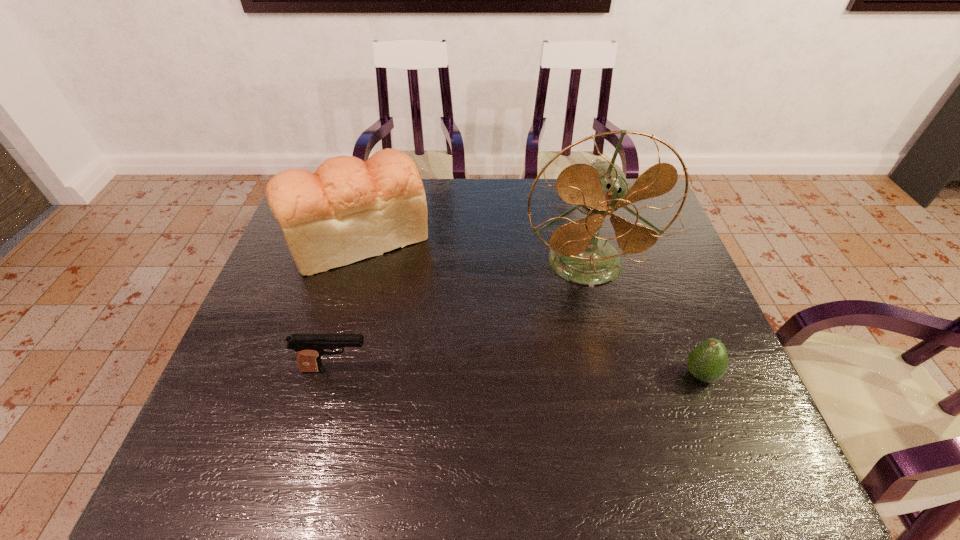
I want to click on pistol present at the left edge, so click(309, 347).

At what (x,y) coordinates should I click in order to perform the action: click on fan at the right edge. Please return your answer as a coordinate pair (x, y). The width and height of the screenshot is (960, 540). Looking at the image, I should click on (577, 253).

I want to click on avocado that is at the right edge, so click(x=707, y=362).

Image resolution: width=960 pixels, height=540 pixels. Identify the location of object at the far left corner. (348, 210).

I want to click on free location at the far edge of the desktop, so click(x=464, y=205).

Where is `vacant space at the near edge of the desktop`? The width and height of the screenshot is (960, 540). vacant space at the near edge of the desktop is located at coordinates (372, 477).

You are a GUI agent. You are given a task and a screenshot of the screen. Output one action in this format:
    pyautogui.click(x=<x>, y=<y>)
    Task: Click on the free space at the left edge
    This screenshot has height=540, width=960.
    Given the screenshot: What is the action you would take?
    pyautogui.click(x=288, y=375)

I want to click on vacant space at the right edge of the desktop, so click(x=695, y=397).

Identify the location of free region at the far right corner. This screenshot has width=960, height=540. (644, 203).

Find the location of a particular element. This screenshot has height=540, width=960. blank space at the near right corner of the desktop is located at coordinates (714, 457).